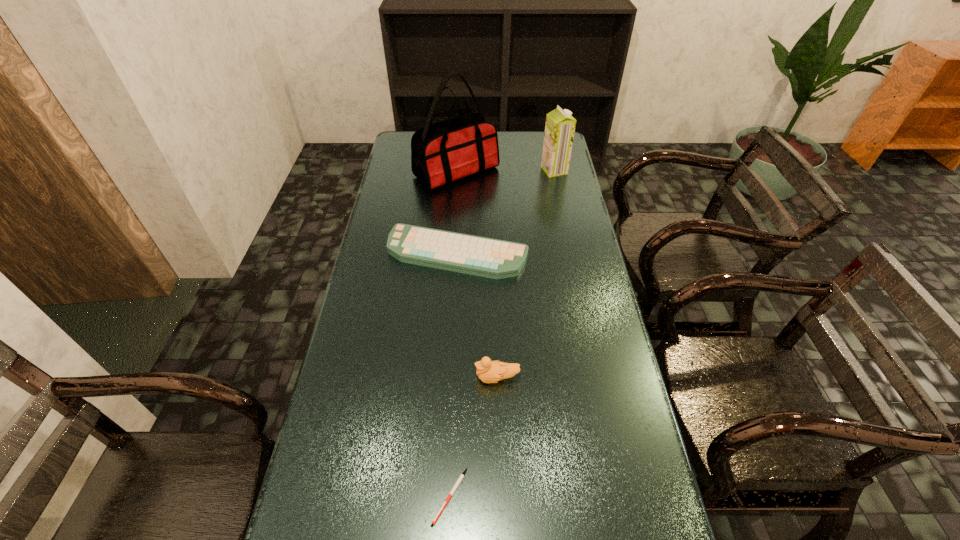
Where is `duffel bag`? This screenshot has height=540, width=960. duffel bag is located at coordinates (442, 152).

At what (x,y) coordinates should I click in order to perform the action: click on the fourth shortest object. Please return your answer as a coordinate pair (x, y). This screenshot has height=540, width=960. Looking at the image, I should click on (560, 126).

You are a GUI agent. You are given a task and a screenshot of the screen. Output one action in this format:
    pyautogui.click(x=<x>, y=<y>)
    Task: Click on the rightmost object
    The width and height of the screenshot is (960, 540).
    Given the screenshot: What is the action you would take?
    pyautogui.click(x=560, y=126)

Where is `the second nearest object`? the second nearest object is located at coordinates (488, 371).

This screenshot has height=540, width=960. I want to click on duckling, so click(x=488, y=371).

Locate an element on the screen. Image resolution: width=960 pixels, height=540 pixels. the third nearest object is located at coordinates (480, 256).

You are a GUI agent. You are given a task and a screenshot of the screen. Output one action in this format:
    pyautogui.click(x=<x>, y=<y>)
    Task: Click on the second shortest object
    
    Given the screenshot: What is the action you would take?
    pyautogui.click(x=480, y=256)

Identify the location of pen. click(460, 478).

Find the location of a particular element. Image resolution: width=960 pixels, height=540 pixels. the nearest object is located at coordinates (460, 478).

This screenshot has height=540, width=960. Find the location of `blank space located 0.270m on the front of the duffel bag`. blank space located 0.270m on the front of the duffel bag is located at coordinates (451, 240).